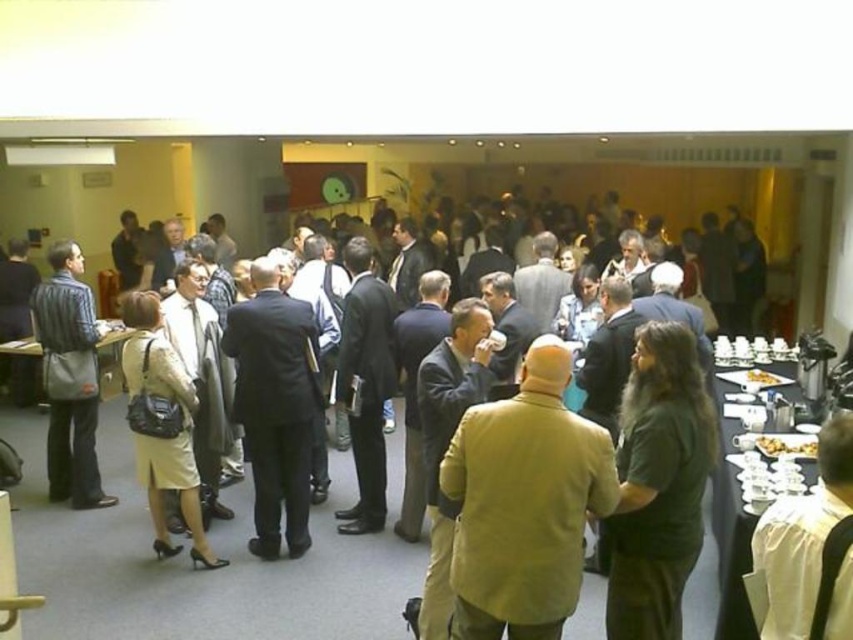
You are standing at the entrance of the conference room and want to move towards the two points marked in the image. Which point, point (498, 532) or point (164, 442), will you reach first?

Point (498, 532) is closer to the camera than point (164, 442), so you will reach point (498, 532) first.

You are an event organizer who needs to arrange a coat rack for attendees. The dark suit at center and the matte black bag at left belong to two different guests. Which item requires a larger space on the coat rack?

The dark suit at center requires a larger space on the coat rack because it has a larger size compared to the matte black bag at left.